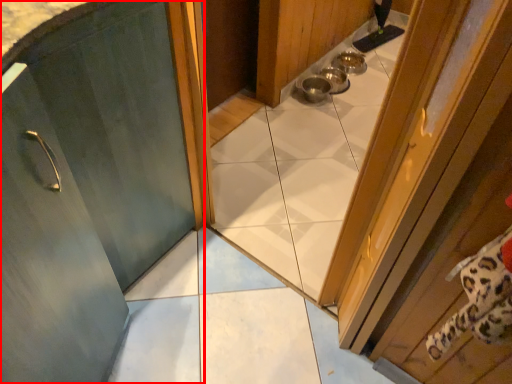
Question: Observing the image, what is the correct spatial positioning of door (annotated by the red box) in reference to door?

Choices:
 (A) right
 (B) left

Answer: (B)